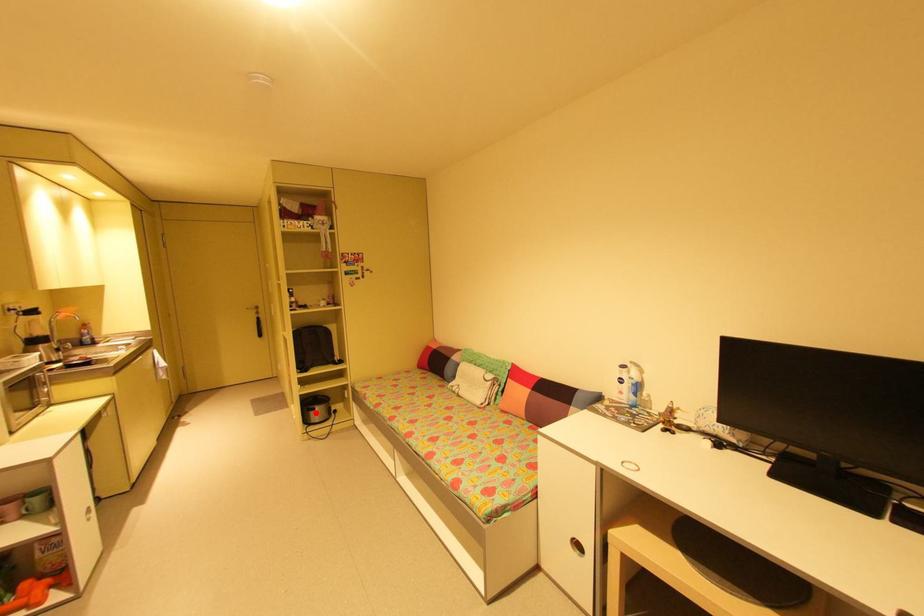
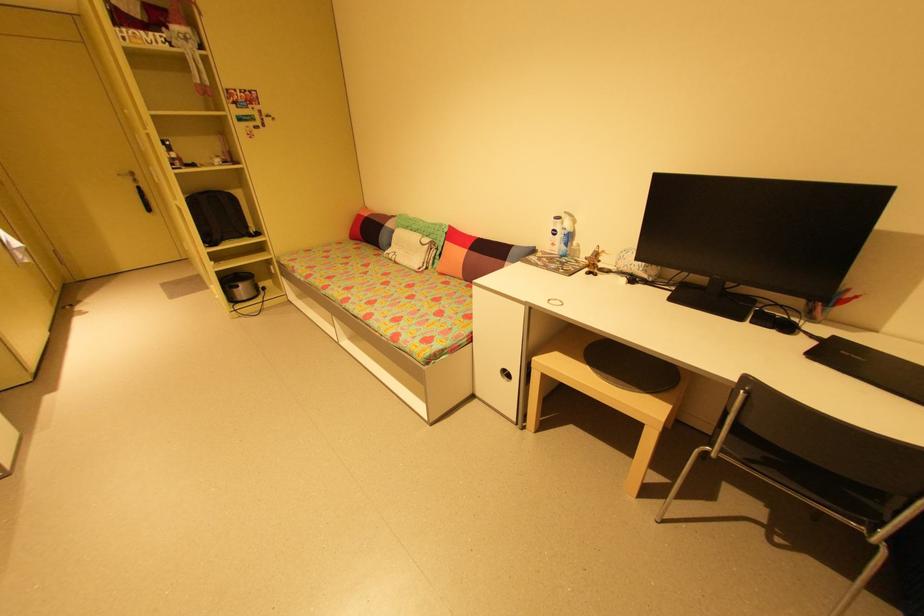
The point at the highlighted location is marked in the first image. Where is the corresponding point in the second image?

(239, 291)